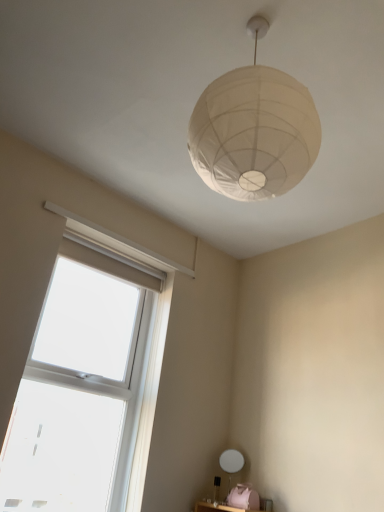
Question: From the image's perspective, does white matte table lamp at lower center appear lower than white paper lampshade at upper center?

Choices:
 (A) no
 (B) yes

Answer: (B)

Question: Is white matte table lamp at lower center shorter than white paper lampshade at upper center?

Choices:
 (A) no
 (B) yes

Answer: (B)

Question: Is white matte table lamp at lower center turned away from white paper lampshade at upper center?

Choices:
 (A) yes
 (B) no

Answer: (B)

Question: Could you tell me if white matte table lamp at lower center is turned towards white paper lampshade at upper center?

Choices:
 (A) no
 (B) yes

Answer: (A)

Question: Does white matte table lamp at lower center lie behind white paper lampshade at upper center?

Choices:
 (A) yes
 (B) no

Answer: (A)

Question: Considering the positions of white matte table lamp at lower center and clear glass window at lower left in the image, is white matte table lamp at lower center bigger or smaller than clear glass window at lower left?

Choices:
 (A) small
 (B) big

Answer: (A)

Question: Considering the positions of white matte table lamp at lower center and clear glass window at lower left in the image, is white matte table lamp at lower center taller or shorter than clear glass window at lower left?

Choices:
 (A) short
 (B) tall

Answer: (A)

Question: Is white matte table lamp at lower center inside or outside of clear glass window at lower left?

Choices:
 (A) inside
 (B) outside

Answer: (B)

Question: From the image's perspective, is white matte table lamp at lower center located above or below clear glass window at lower left?

Choices:
 (A) below
 (B) above

Answer: (A)

Question: Considering the positions of clear glass window at lower left and white paper lampshade at upper center in the image, is clear glass window at lower left wider or thinner than white paper lampshade at upper center?

Choices:
 (A) wide
 (B) thin

Answer: (B)

Question: Is point (66, 376) positioned closer to the camera than point (266, 140)?

Choices:
 (A) farther
 (B) closer

Answer: (A)

Question: In the image, is clear glass window at lower left positioned in front of or behind white paper lampshade at upper center?

Choices:
 (A) front
 (B) behind

Answer: (B)

Question: Considering the positions of clear glass window at lower left and white paper lampshade at upper center in the image, is clear glass window at lower left taller or shorter than white paper lampshade at upper center?

Choices:
 (A) short
 (B) tall

Answer: (B)

Question: From their relative heights in the image, would you say white matte table lamp at lower center is taller or shorter than white paper lampshade at upper center?

Choices:
 (A) short
 (B) tall

Answer: (A)

Question: From a real-world perspective, is white matte table lamp at lower center positioned above or below white paper lampshade at upper center?

Choices:
 (A) below
 (B) above

Answer: (A)